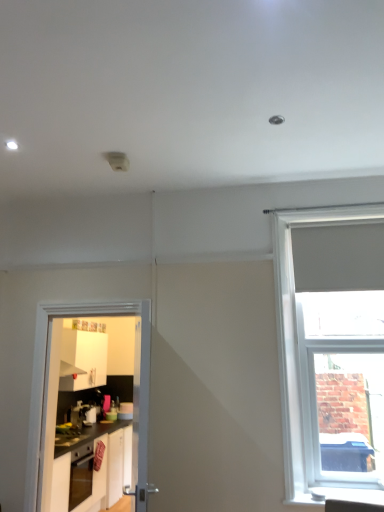
Question: In terms of height, does white glossy cabinets at lower left look taller or shorter compared to white smooth window sill at lower right?

Choices:
 (A) tall
 (B) short

Answer: (A)

Question: From a real-world perspective, is white glossy cabinets at lower left above or below white smooth window sill at lower right?

Choices:
 (A) above
 (B) below

Answer: (B)

Question: Estimate the real-world distances between objects in this image. Which object is farther from the white glossy door at left?

Choices:
 (A) satin silver coffee machine at left
 (B) white smooth window sill at lower right
 (C) white matte window at right
 (D) white glossy cabinets at lower left

Answer: (A)

Question: Considering the real-world distances, which object is closest to the white glossy cabinets at lower left?

Choices:
 (A) white matte window at right
 (B) white glossy door at left
 (C) satin silver coffee machine at left
 (D) white smooth window sill at lower right

Answer: (C)